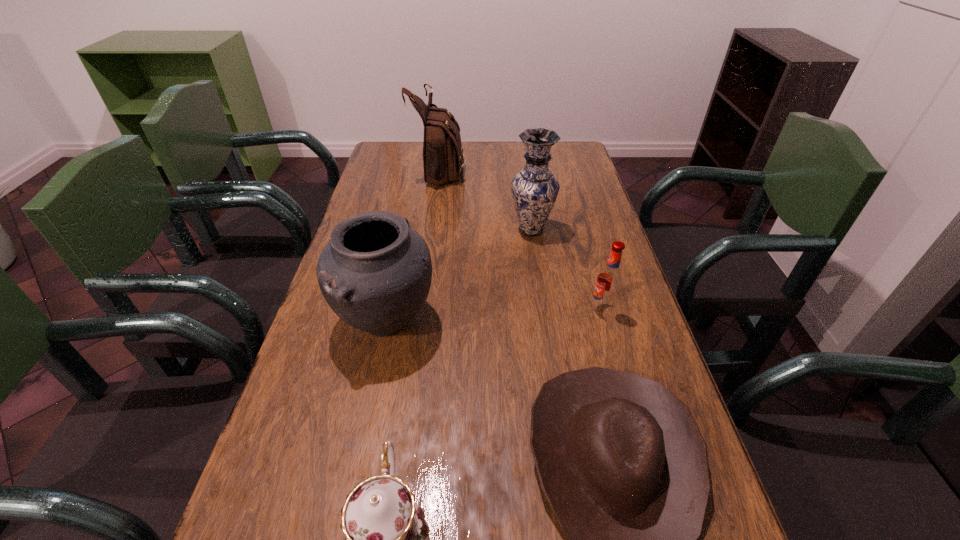
Locate an element on the screen. The image size is (960, 540). free region that satisfies the following two spatial constraints: 1. on the front-facing side of the root beer; 2. on the left side of the farthest object is located at coordinates (420, 310).

At what (x,y) coordinates should I click in order to perform the action: click on free space in the image that satisfies the following two spatial constraints: 1. on the front-facing side of the second farthest object; 2. on the right side of the shoulder bag. Please return your answer as a coordinate pair (x, y). Looking at the image, I should click on (432, 230).